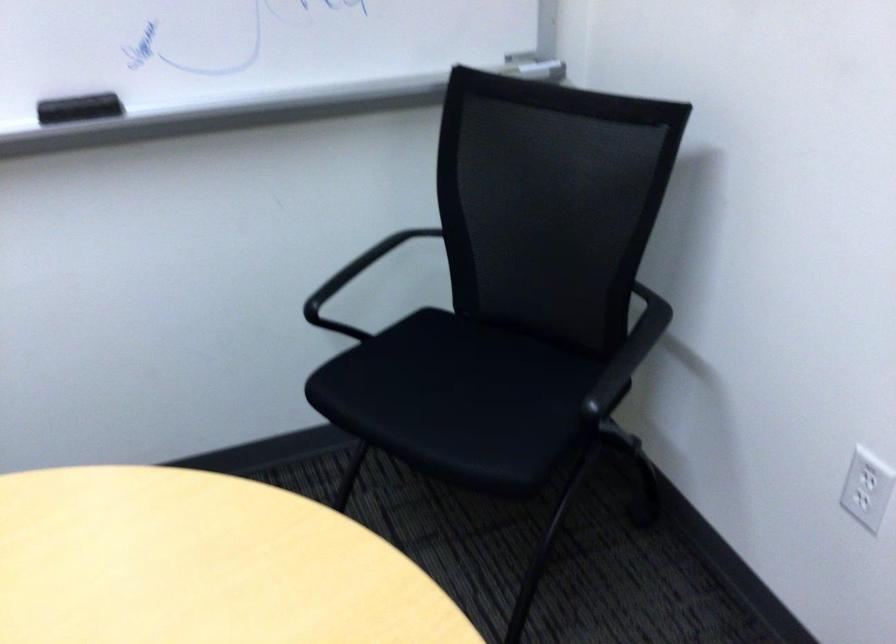
The image size is (896, 644). I want to click on black whiteboard eraser, so click(x=79, y=108).